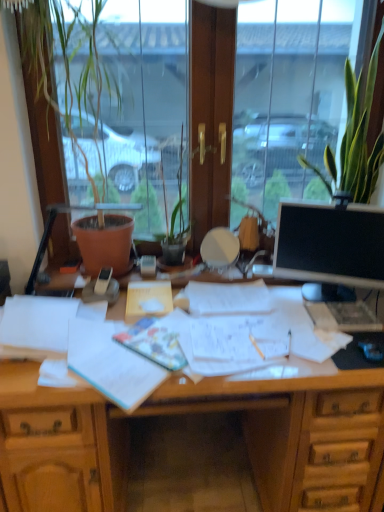
Question: From a real-world perspective, is light blue paper at center, positioned as the first document in bottom-to-top order, physically located above or below green leafy plant at upper right?

Choices:
 (A) above
 (B) below

Answer: (B)

Question: Considering the relative positions of light blue paper at center, positioned as the first document in bottom-to-top order, and green leafy plant at upper right in the image provided, is light blue paper at center, positioned as the first document in bottom-to-top order, to the left or to the right of green leafy plant at upper right?

Choices:
 (A) left
 (B) right

Answer: (A)

Question: Which object is positioned closest to the black glossy monitor at right?

Choices:
 (A) light blue paper at center, the second document from the back
 (B) white paper at center, which is the 2th document in front-to-back order
 (C) green leafy plant at upper right
 (D) transparent glass window at center
 (E) matte black phone at center

Answer: (C)

Question: Which object is positioned farthest from the green leafy plant at upper right?

Choices:
 (A) transparent glass window at center
 (B) terracotta pot at left
 (C) wooden desk at center
 (D) matte black phone at center
 (E) black glossy monitor at right

Answer: (A)